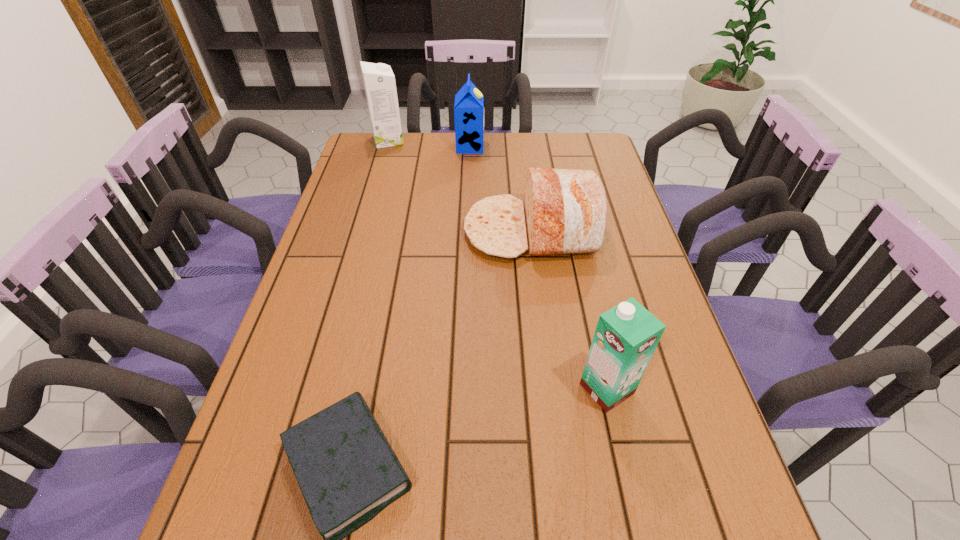
At what (x,y) coordinates should I click in order to perform the action: click on free space between the leftmost carton and the second carton from left to right. Please return your answer as a coordinate pair (x, y). Image resolution: width=960 pixels, height=540 pixels. Looking at the image, I should click on (429, 144).

Identify the location of vacant space that is in between the nearest carton and the second carton from right to left. (539, 268).

Where is `free spot between the second carton from left to right and the third nearest object`? free spot between the second carton from left to right and the third nearest object is located at coordinates (500, 189).

Identify the location of free space between the leftmost carton and the third nearest object. This screenshot has height=540, width=960. (460, 186).

What are the coordinates of `free spot between the second carton from left to right and the nearest carton` in the screenshot? It's located at (539, 268).

Image resolution: width=960 pixels, height=540 pixels. Identify the location of free spot between the rightmost carton and the fourth tallest object. (569, 310).

This screenshot has height=540, width=960. Identify the location of object that is the third nearest to the Bible. (469, 105).

Where is `the third closest object to the leftmost carton`? The image size is (960, 540). the third closest object to the leftmost carton is located at coordinates (347, 471).

Where is `carton that is the nearest to the second carton from right to left`? carton that is the nearest to the second carton from right to left is located at coordinates (379, 82).

I want to click on carton that stands as the second closest to the bread, so click(626, 336).